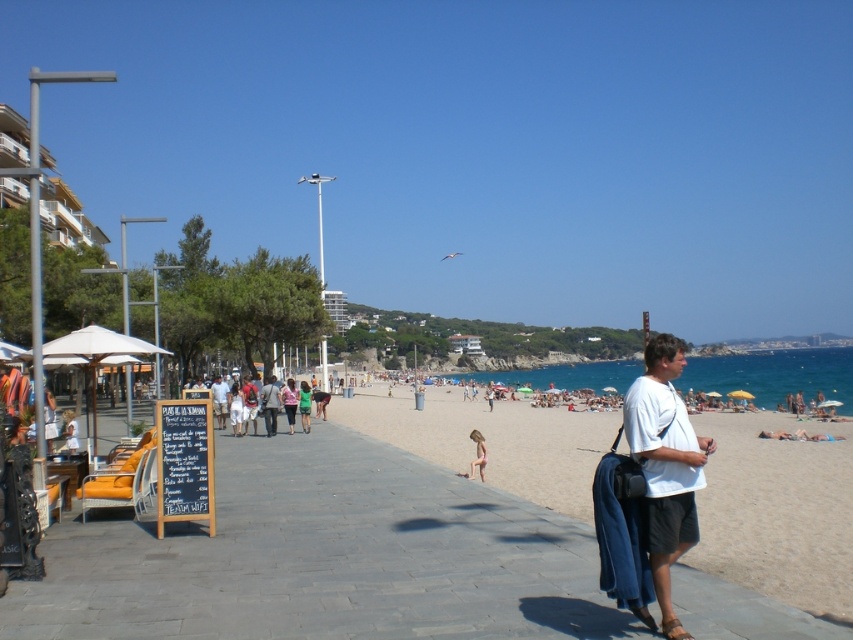
Between white cotton shirt at center-right and pink fabric bikini at lower center, which one appears on the left side from the viewer's perspective?

pink fabric bikini at lower center is more to the left.

Between point (640, 385) and point (471, 472), which one is positioned behind?

The point (471, 472) is behind.

The height and width of the screenshot is (640, 853). In order to click on white cotton shirt at center-right in this screenshot , I will do `click(665, 465)`.

I want to click on white cotton shirt at center-right, so click(665, 465).

Does beige sand at beach center have a greater height compared to pink fabric bikini at lower center?

Indeed, beige sand at beach center has a greater height compared to pink fabric bikini at lower center.

Does point (461, 429) come farther from viewer compared to point (479, 436)?

Yes, point (461, 429) is behind point (479, 436).

Where is `beige sand at beach center`? Image resolution: width=853 pixels, height=640 pixels. beige sand at beach center is located at coordinates (778, 512).

Who is positioned more to the left, beige sand at beach center or white cotton shirt at center-right?

white cotton shirt at center-right

Is beige sand at beach center smaller than white cotton shirt at center-right?

Actually, beige sand at beach center might be larger than white cotton shirt at center-right.

Locate an element on the screen. Image resolution: width=853 pixels, height=640 pixels. beige sand at beach center is located at coordinates (778, 512).